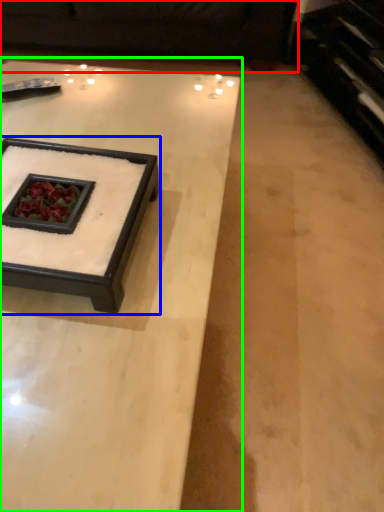
Question: Which object is positioned closest to couch (highlighted by a red box)? Select from coffee table (highlighted by a blue box) and coffee table (highlighted by a green box).

Choices:
 (A) coffee table
 (B) coffee table

Answer: (B)